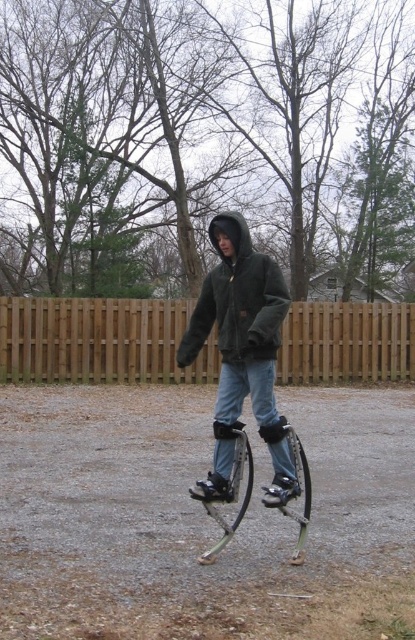
Which is in front, point (224, 492) or point (234, 525)?

Point (224, 492) is in front.

Between green fuzzy jacket at center and silver metallic stilts at center, which one has more height?

green fuzzy jacket at center is taller.

Which is behind, point (190, 321) or point (221, 540)?

Point (190, 321)

Identify the location of green fuzzy jacket at center. (241, 352).

Locate an element on the screen. The image size is (415, 640). brown wooden fence at center is located at coordinates (99, 340).

Where is `brown wooden fence at center`? brown wooden fence at center is located at coordinates click(x=99, y=340).

Who is more distant from viewer, (361, 355) or (229, 342)?

The point (361, 355) is more distant.

Is the position of brown wooden fence at center more distant than that of green fuzzy jacket at center?

Yes.

Who is more distant from viewer, [314,314] or [219,392]?

The point [314,314] is behind.

You are a GUI agent. You are given a task and a screenshot of the screen. Output one action in this format:
    pyautogui.click(x=<x>, y=<y>)
    Task: Click on the brown wooden fence at center
    
    Given the screenshot: What is the action you would take?
    pyautogui.click(x=99, y=340)